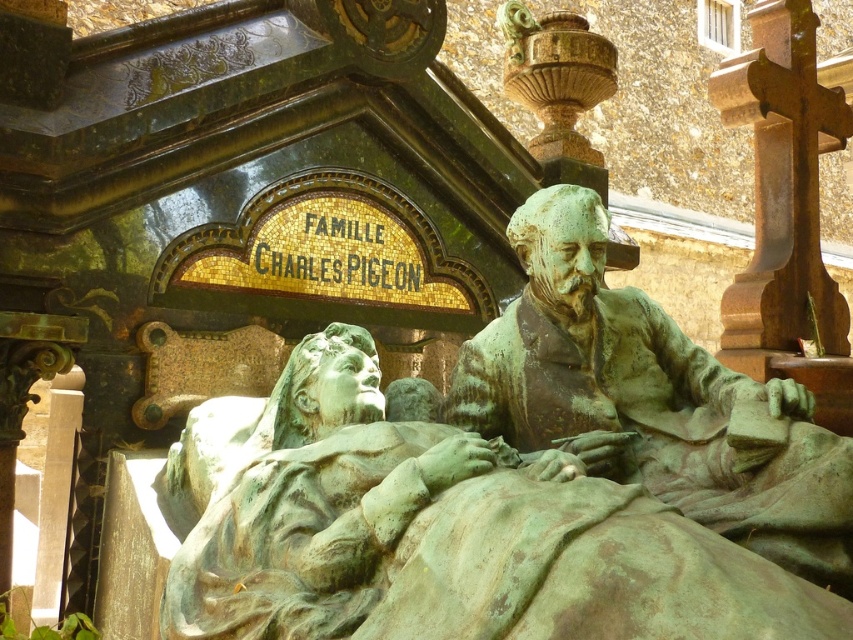
Question: Observing the image, what is the correct spatial positioning of green patina statue at center in reference to green patinated bronze statue at center?

Choices:
 (A) right
 (B) left

Answer: (B)

Question: Does green patina statue at center have a smaller size compared to green patinated bronze statue at center?

Choices:
 (A) yes
 (B) no

Answer: (B)

Question: Is green patina statue at center smaller than green patinated bronze statue at center?

Choices:
 (A) no
 (B) yes

Answer: (A)